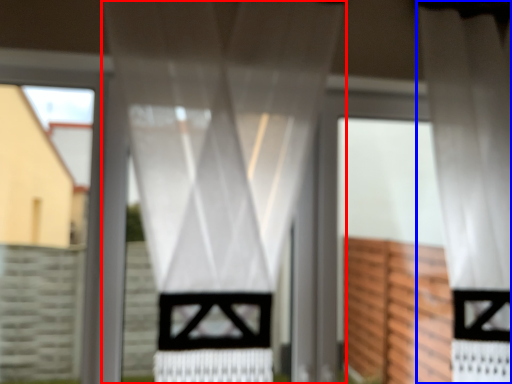
Question: Which point is closer to the camera, curtain (highlighted by a red box) or curtain (highlighted by a blue box)?

Choices:
 (A) curtain
 (B) curtain

Answer: (A)